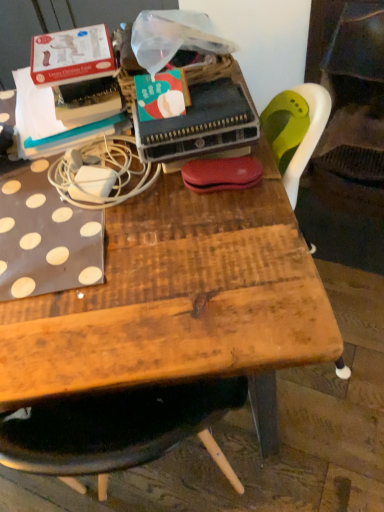
Question: Is white matte power adapter at upper left inside matte green paperback book at center?

Choices:
 (A) yes
 (B) no

Answer: (B)

Question: Considering the relative positions of matte green paperback book at center and white matte power adapter at upper left in the image provided, is matte green paperback book at center to the left of white matte power adapter at upper left from the viewer's perspective?

Choices:
 (A) no
 (B) yes

Answer: (A)

Question: Is matte green paperback book at center looking in the opposite direction of white matte power adapter at upper left?

Choices:
 (A) no
 (B) yes

Answer: (A)

Question: Can you confirm if matte green paperback book at center is shorter than white matte power adapter at upper left?

Choices:
 (A) no
 (B) yes

Answer: (A)

Question: From the image's perspective, is matte green paperback book at center located beneath white matte power adapter at upper left?

Choices:
 (A) no
 (B) yes

Answer: (A)

Question: From a real-world perspective, is matte green paperback book at center on white matte power adapter at upper left?

Choices:
 (A) no
 (B) yes

Answer: (B)

Question: Does wooden table at center have a smaller size compared to matte green paperback book at center?

Choices:
 (A) no
 (B) yes

Answer: (A)

Question: From the image's perspective, is wooden table at center below matte green paperback book at center?

Choices:
 (A) no
 (B) yes

Answer: (B)

Question: Is wooden table at center outside of matte green paperback book at center?

Choices:
 (A) no
 (B) yes

Answer: (B)

Question: Is wooden table at center positioned in front of matte green paperback book at center?

Choices:
 (A) yes
 (B) no

Answer: (B)

Question: Considering the relative sizes of wooden table at center and matte green paperback book at center in the image provided, is wooden table at center wider than matte green paperback book at center?

Choices:
 (A) yes
 (B) no

Answer: (A)

Question: Considering the relative positions of wooden table at center and matte green paperback book at center in the image provided, is wooden table at center to the right of matte green paperback book at center from the viewer's perspective?

Choices:
 (A) no
 (B) yes

Answer: (B)

Question: Is wooden table at center with white matte power adapter at upper left?

Choices:
 (A) no
 (B) yes

Answer: (A)